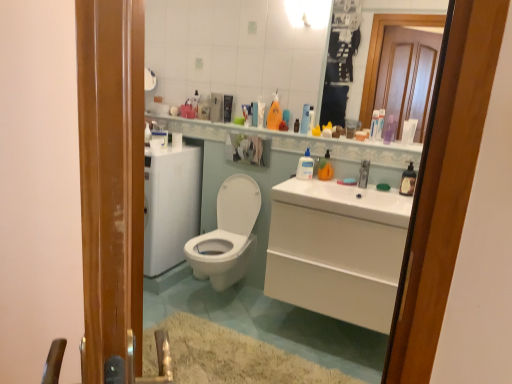
Question: From the image's perspective, is translucent plastic bottle at upper center, the 3th toiletry positioned from the left, below clear plastic bottle at center, the 3th cleaning product when ordered from back to front?

Choices:
 (A) no
 (B) yes

Answer: (A)

Question: Is there a large distance between translucent plastic bottle at upper center, the 3th toiletry positioned from the left, and clear plastic bottle at center, the second cleaning product when ordered from left to right?

Choices:
 (A) yes
 (B) no

Answer: (B)

Question: Does translucent plastic bottle at upper center, the 6th toiletry when ordered from right to left, turn towards clear plastic bottle at center, the second cleaning product when ordered from left to right?

Choices:
 (A) yes
 (B) no

Answer: (B)

Question: Is translucent plastic bottle at upper center, the 6th toiletry when ordered from right to left, next to clear plastic bottle at center, the 3th cleaning product when ordered from back to front?

Choices:
 (A) yes
 (B) no

Answer: (B)

Question: From a real-world perspective, is translucent plastic bottle at upper center, the 3th toiletry positioned from the left, positioned under clear plastic bottle at center, the 3th cleaning product when ordered from back to front, based on gravity?

Choices:
 (A) no
 (B) yes

Answer: (A)

Question: Is translucent plastic bottle at upper center, the 3th toiletry positioned from the left, positioned with its back to clear plastic bottle at center, the 3th cleaning product when ordered from back to front?

Choices:
 (A) yes
 (B) no

Answer: (B)

Question: Are white glossy sink at center, the 2th sink when ordered from right to left, and translucent plastic tube at upper center, the second toiletry in the right-to-left sequence, making contact?

Choices:
 (A) yes
 (B) no

Answer: (B)

Question: From the image's perspective, would you say white glossy sink at center, the 2th sink when ordered from right to left, is shown under translucent plastic tube at upper center, the second toiletry in the right-to-left sequence?

Choices:
 (A) yes
 (B) no

Answer: (A)

Question: Is white glossy sink at center, arranged as the first sink when viewed from the left, bigger than translucent plastic tube at upper center, the second toiletry in the right-to-left sequence?

Choices:
 (A) yes
 (B) no

Answer: (A)

Question: Is white glossy sink at center, the 2th sink when ordered from right to left, at the left side of translucent plastic tube at upper center, the second toiletry in the right-to-left sequence?

Choices:
 (A) no
 (B) yes

Answer: (B)

Question: Are white glossy sink at center, the 2th sink when ordered from right to left, and translucent plastic tube at upper center, which appears as the 7th toiletry when viewed from the left, located far from each other?

Choices:
 (A) no
 (B) yes

Answer: (A)

Question: Is white glossy sink at center, the 2th sink when ordered from right to left, positioned with its back to translucent plastic tube at upper center, which appears as the 7th toiletry when viewed from the left?

Choices:
 (A) yes
 (B) no

Answer: (B)

Question: Is clear glass mirror at upper center taller than translucent plastic soap dispenser at upper center, acting as the 5th toiletry starting from the left?

Choices:
 (A) yes
 (B) no

Answer: (A)